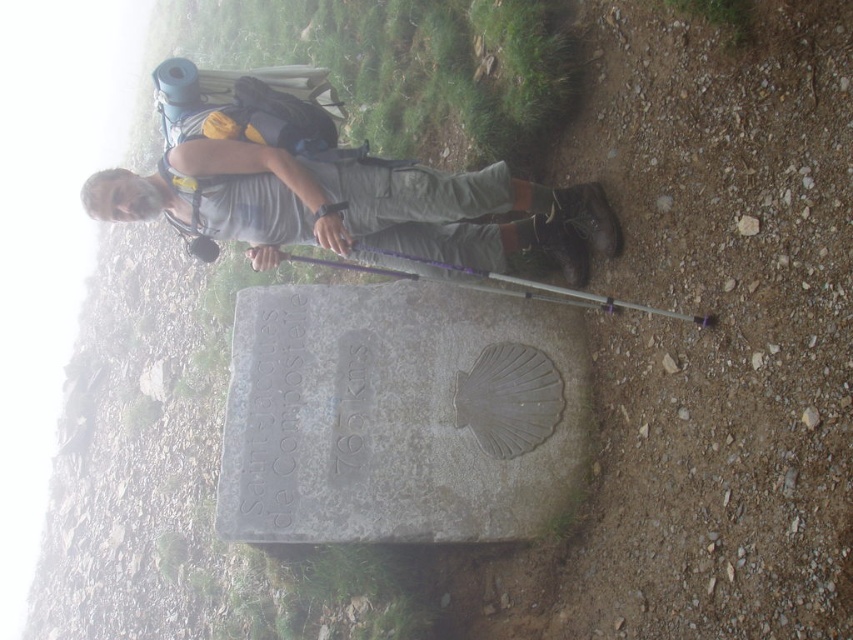
Does gray stone marker at center have a larger size compared to purple plastic ski pole at center?

Yes, gray stone marker at center is bigger than purple plastic ski pole at center.

Does point (285, 308) come farther from viewer compared to point (393, 257)?

That is True.

In order to click on gray stone marker at center in this screenshot , I will do `click(399, 416)`.

Is the position of gray fabric backpack at upper center more distant than that of purple plastic ski pole at center?

That is True.

Between gray fabric backpack at upper center and purple plastic ski pole at center, which one appears on the left side from the viewer's perspective?

gray fabric backpack at upper center

Measure the distance between point (473, 244) and camera.

The distance of point (473, 244) from camera is 9.78 meters.

You are a GUI agent. You are given a task and a screenshot of the screen. Output one action in this format:
    pyautogui.click(x=<x>, y=<y>)
    Task: Click on the gray fabric backpack at upper center
    This screenshot has height=640, width=853.
    Given the screenshot: What is the action you would take?
    pyautogui.click(x=357, y=205)

Who is shorter, gray stone marker at center or gray fabric backpack at upper center?

gray fabric backpack at upper center

Is gray stone marker at center thinner than gray fabric backpack at upper center?

Indeed, gray stone marker at center has a lesser width compared to gray fabric backpack at upper center.

This screenshot has width=853, height=640. I want to click on gray stone marker at center, so click(x=399, y=416).